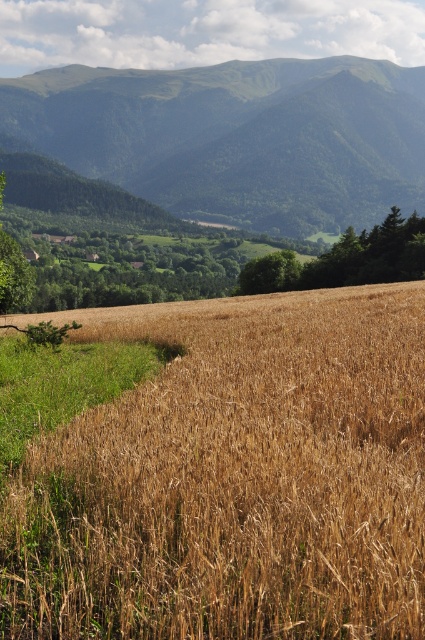
You are standing at the center of the wheat field and see a point marked at coordinates (234, 477). According to the scene, what object is located at that point?

The brown grainy wheat field at lower left is located at point (234, 477).

You are a farmer planning to plant a new row of crops between the brown grainy wheat field at lower left and the green leafy tree at center. Based on their sizes, which area would you choose for the new row to ensure it has enough space?

The brown grainy wheat field at lower left has a larger width than the green leafy tree at center, so you should plant the new row of crops in the area near the brown grainy wheat field at lower left to ensure sufficient space.

You are standing in the valley looking towards the mountains. You see a brown grainy wheat field at lower left and a green grassy mountain at upper center. Which object is positioned to the right of the other?

The brown grainy wheat field at lower left is to the right of the green grassy mountain at upper center.